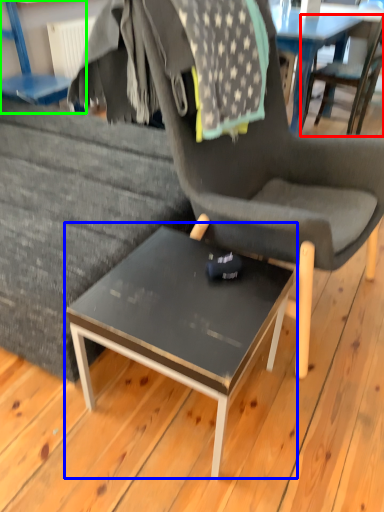
Question: Which object is the farthest from chair (highlighted by a red box)? Choose among these: coffee table (highlighted by a blue box) or chair (highlighted by a green box).

Choices:
 (A) coffee table
 (B) chair

Answer: (A)